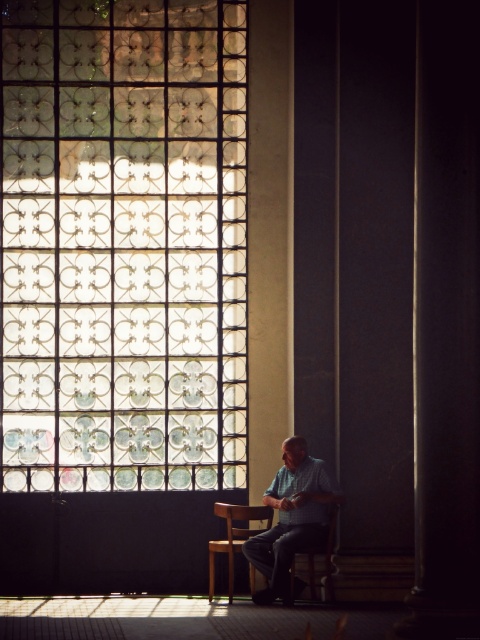
Question: Does clear glass window at upper left appear over wooden chair at center?

Choices:
 (A) no
 (B) yes

Answer: (B)

Question: Is clear glass window at upper left thinner than wooden chair at lower center?

Choices:
 (A) no
 (B) yes

Answer: (A)

Question: Which object appears farthest from the camera in this image?

Choices:
 (A) wooden chair at lower center
 (B) checkered fabric shirt at center

Answer: (A)

Question: Which object appears closest to the camera in this image?

Choices:
 (A) clear glass window at upper left
 (B) wooden chair at center
 (C) wooden chair at lower center
 (D) checkered fabric shirt at center

Answer: (D)

Question: From the image, what is the correct spatial relationship of clear glass window at upper left in relation to wooden chair at lower center?

Choices:
 (A) above
 (B) below

Answer: (A)

Question: Estimate the real-world distances between objects in this image. Which object is farther from the wooden chair at lower center?

Choices:
 (A) clear glass window at upper left
 (B) wooden chair at center

Answer: (A)